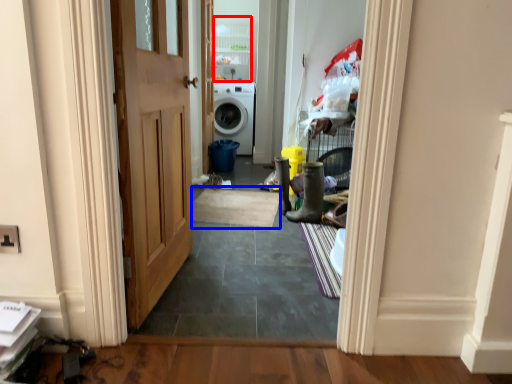
Question: Among these objects, which one is farthest to the camera, cabinetry (highlighted by a red box) or doormat (highlighted by a blue box)?

Choices:
 (A) cabinetry
 (B) doormat

Answer: (A)